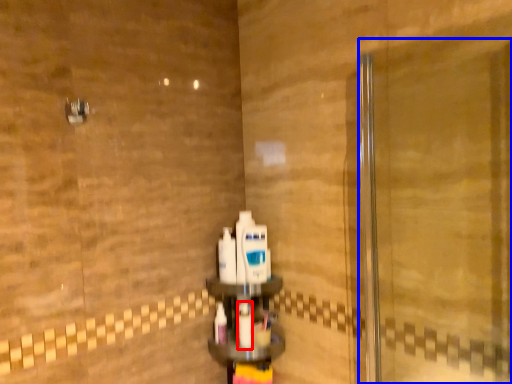
Question: Among these objects, which one is nearest to the camera, mouthwash (highlighted by a red box) or screen door (highlighted by a blue box)?

Choices:
 (A) mouthwash
 (B) screen door

Answer: (B)